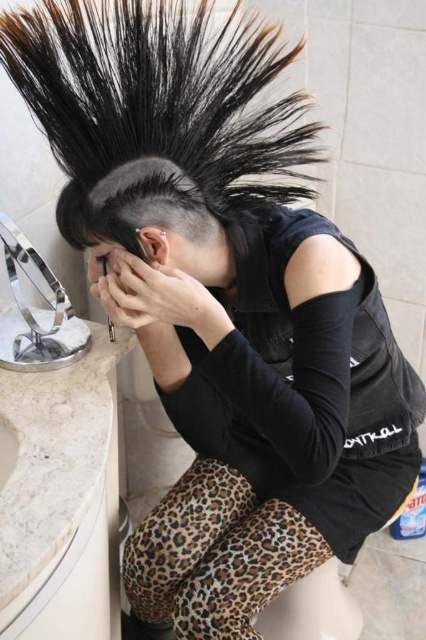
Question: Is black matte hair at upper center closer to camera compared to black matte hand at center?

Choices:
 (A) yes
 (B) no

Answer: (A)

Question: Which object is farther from the camera taking this photo?

Choices:
 (A) black matte hand at center
 (B) black matte hair at upper center

Answer: (A)

Question: Is black matte hair at upper center below black matte shaved head at center?

Choices:
 (A) no
 (B) yes

Answer: (B)

Question: Which object is closer to the camera taking this photo?

Choices:
 (A) black matte shaved head at center
 (B) black matte hand at center

Answer: (A)

Question: Which point is closer to the camera?

Choices:
 (A) black matte shaved head at center
 (B) black matte hair at upper center
 (C) black matte hand at center

Answer: (A)

Question: Is black matte hair at upper center smaller than black matte shaved head at center?

Choices:
 (A) yes
 (B) no

Answer: (B)